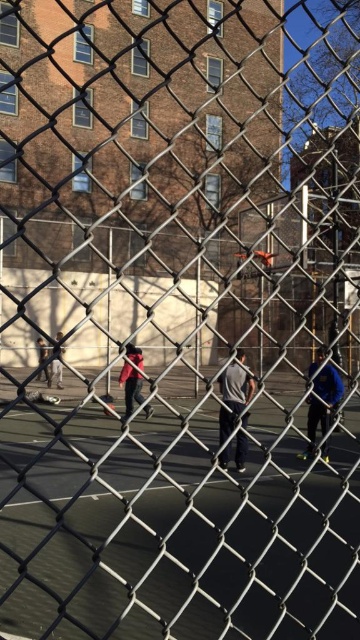
Question: Which point is closer to the camera?

Choices:
 (A) dark gray hoodie at left
 (B) green rubber tennis court at center

Answer: (B)

Question: Is gray fabric jacket at center bigger than dark gray hoodie at left?

Choices:
 (A) yes
 (B) no

Answer: (B)

Question: Which of these objects is positioned closest to the dark gray hoodie at left?

Choices:
 (A) green rubber tennis court at center
 (B) red fabric jacket at center
 (C) gray fabric jacket at center
 (D) blue matte jacket at center

Answer: (B)

Question: Where is green rubber tennis court at center located in relation to gray fabric jacket at center in the image?

Choices:
 (A) below
 (B) above

Answer: (A)

Question: Which object appears closest to the camera in this image?

Choices:
 (A) blue matte jacket at center
 (B) green rubber tennis court at center

Answer: (B)

Question: Does gray fabric jacket at center appear under dark blue jacket at center?

Choices:
 (A) no
 (B) yes

Answer: (B)